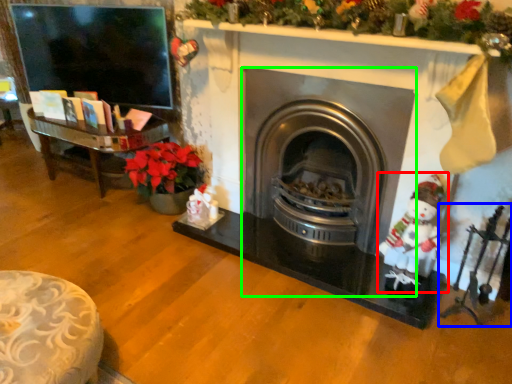
Question: Considering the real-world distances, which object is farthest from santa claus (highlighted by a red box)? toy (highlighted by a blue box) or wood burning stove (highlighted by a green box)?

Choices:
 (A) toy
 (B) wood burning stove

Answer: (B)